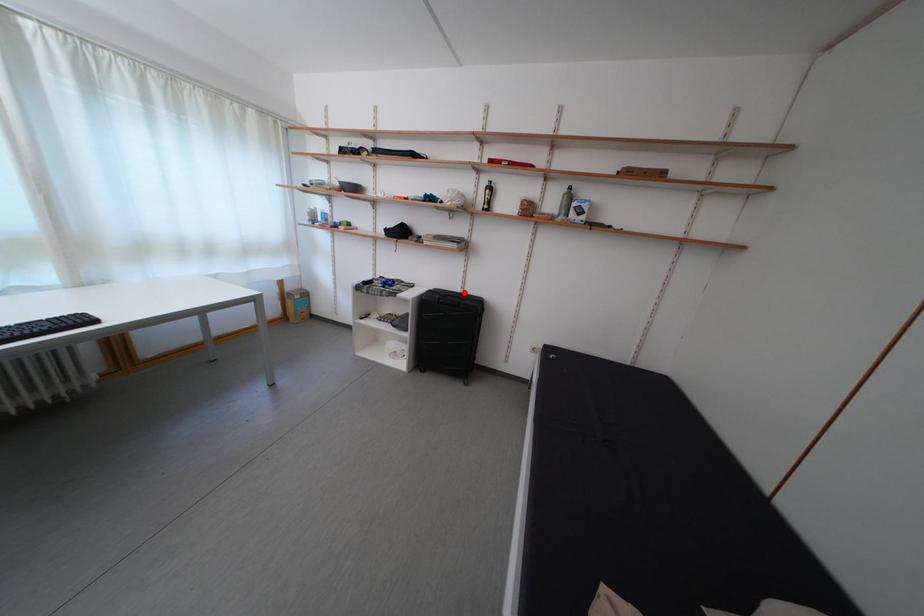
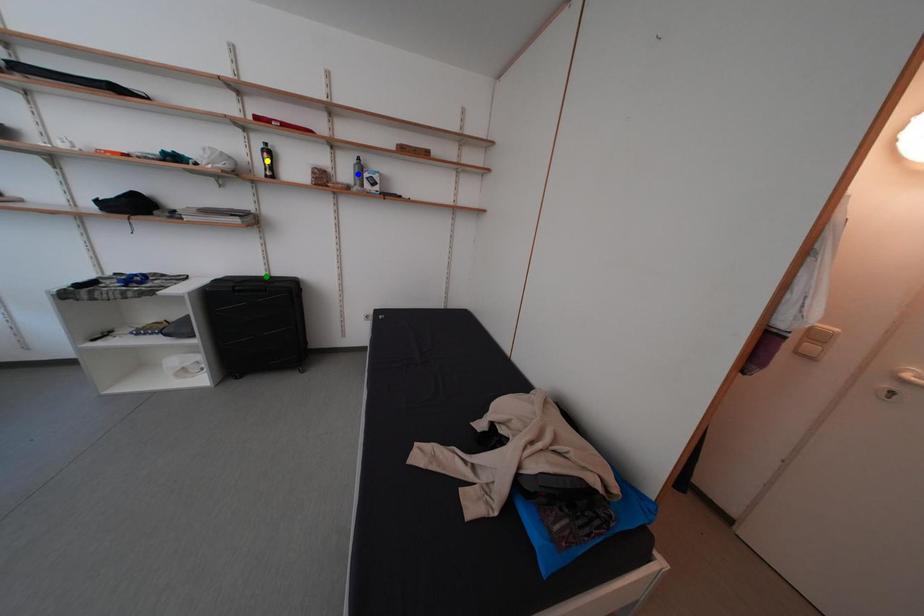
Question: I am providing you with two images of the same scene from different viewpoints. A red point is marked on the first image. You are given multiple points on the second image. Which point in image 2 represents the same 3d spot as the red point in image 1?

Choices:
 (A) blue point
 (B) yellow point
 (C) green point

Answer: (C)